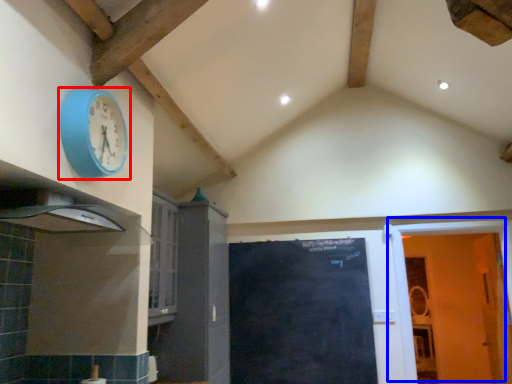
Question: Among these objects, which one is farthest to the camera, wall clock (highlighted by a red box) or door (highlighted by a blue box)?

Choices:
 (A) wall clock
 (B) door

Answer: (B)